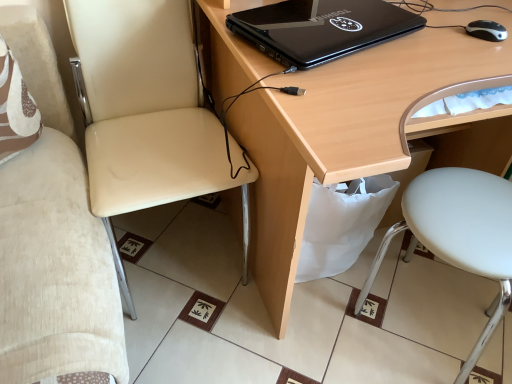
Find the location of a particular element. The image size is (512, 384). vacant area that lies between beige leather chair at left, which is the first chair from left to right, and light wood desk at center is located at coordinates (207, 336).